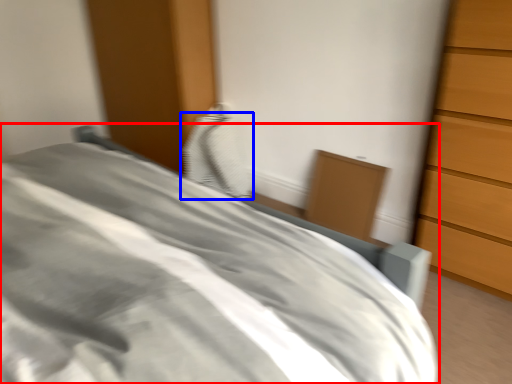
Question: Which of the following is the closest to the observer, bed (highlighted by a red box) or pillow (highlighted by a blue box)?

Choices:
 (A) bed
 (B) pillow

Answer: (A)